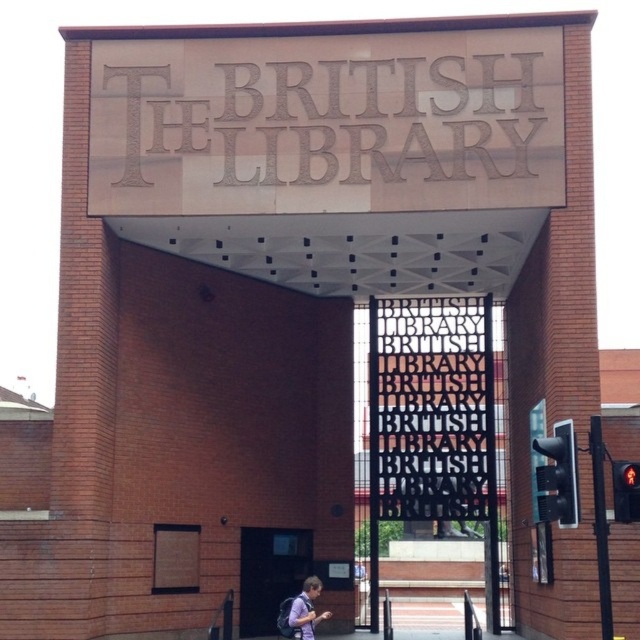
You are standing at the entrance of The British Library and want to take a photo of both the black metal sign at center and the purple fabric backpack at lower center. Which object should you focus on first if you want to ensure both are in the frame without moving the camera?

You should focus on the black metal sign at center first because it is taller than the purple fabric backpack at lower center, so positioning the camera to include its full height will naturally include the smaller backpack in the frame as well.

You are standing at the entrance of The British Library and want to take a photo of the black metal sign at center and the purple fabric backpack at lower center. Which object should you focus on first if you want to capture both in a single frame without moving your camera?

You should focus on the black metal sign at center first because it is larger than the purple fabric backpack at lower center, so it will require less adjustment to include both in the frame.